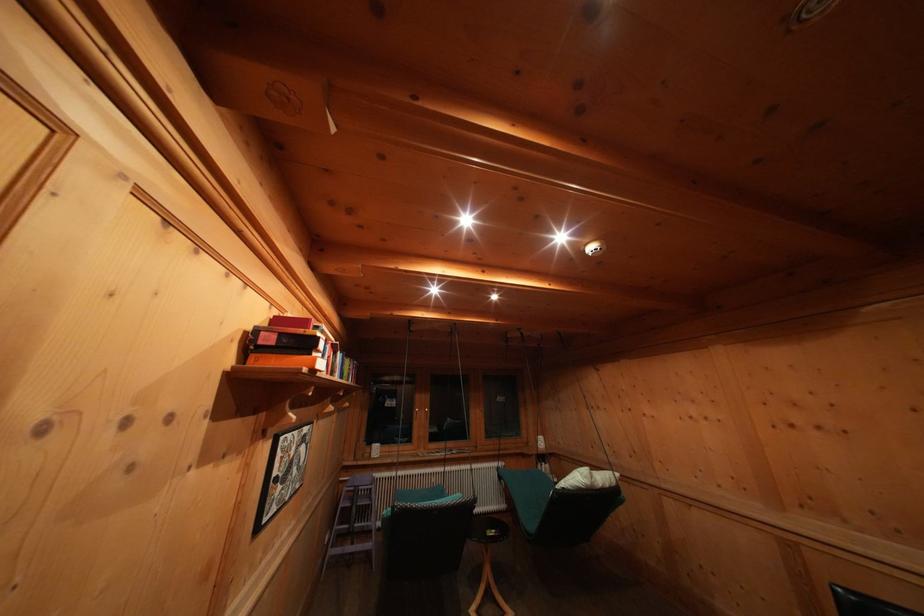
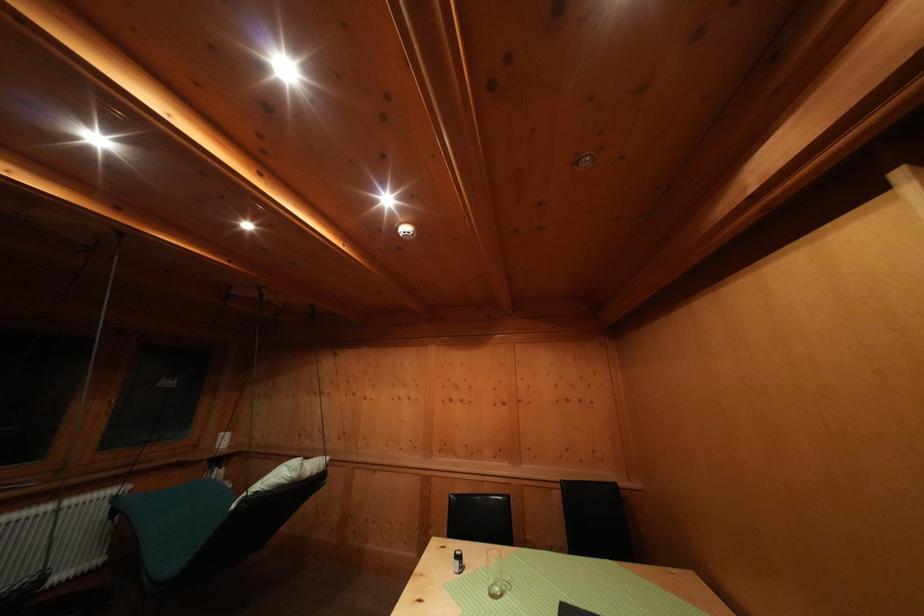
Question: The first image is from the beginning of the video and the second image is from the end. How did the camera likely rotate when shooting the video?

Choices:
 (A) Left
 (B) Right
 (C) Up
 (D) Down

Answer: (B)